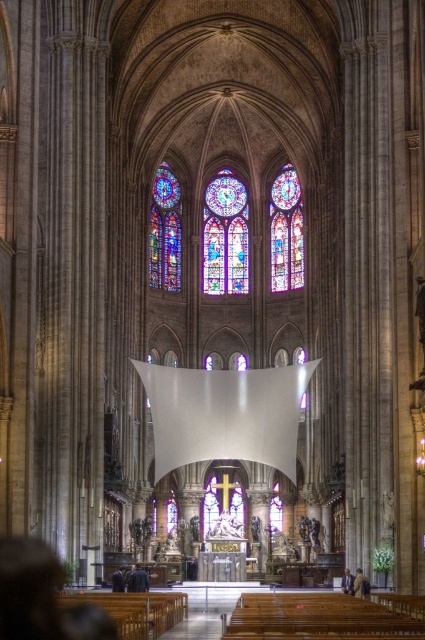
Which is in front, point (224, 243) or point (278, 211)?

Point (278, 211) is in front.

Is point (212, 214) positioned behind point (291, 225)?

Yes, it is behind point (291, 225).

The image size is (425, 640). Describe the element at coordinates (224, 236) in the screenshot. I see `multicolored stained glass at upper center` at that location.

This screenshot has height=640, width=425. What are the coordinates of `multicolored stained glass at upper center` in the screenshot? It's located at (224, 236).

Find the location of a particular element. The height and width of the screenshot is (640, 425). stained glass window at center is located at coordinates pyautogui.click(x=286, y=230).

Which is below, stained glass window at center or stained glass window at left?

stained glass window at center is lower down.

Identify the location of stained glass window at center. Image resolution: width=425 pixels, height=640 pixels. (286, 230).

At what (x,y) coordinates should I click in order to perform the action: click on stained glass window at center. Please return your answer as a coordinate pair (x, y). The width and height of the screenshot is (425, 640). Looking at the image, I should click on (x=286, y=230).

Which is behind, point (212, 282) or point (155, 232)?

Point (212, 282)

In the scene shown: Can you confirm if multicolored stained glass at upper center is smaller than stained glass window at left?

No, multicolored stained glass at upper center is not smaller than stained glass window at left.

Find the location of a particular element. multicolored stained glass at upper center is located at coordinates (224, 236).